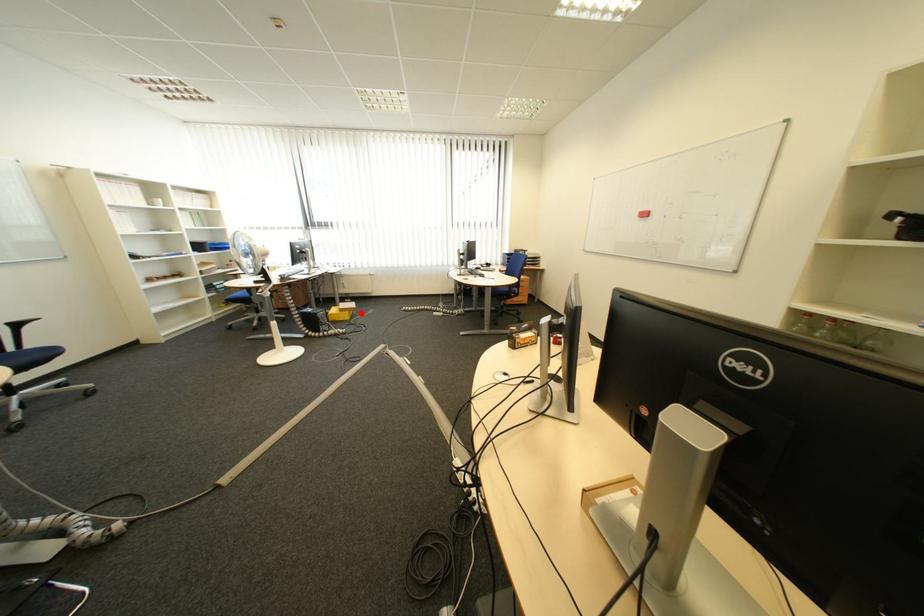
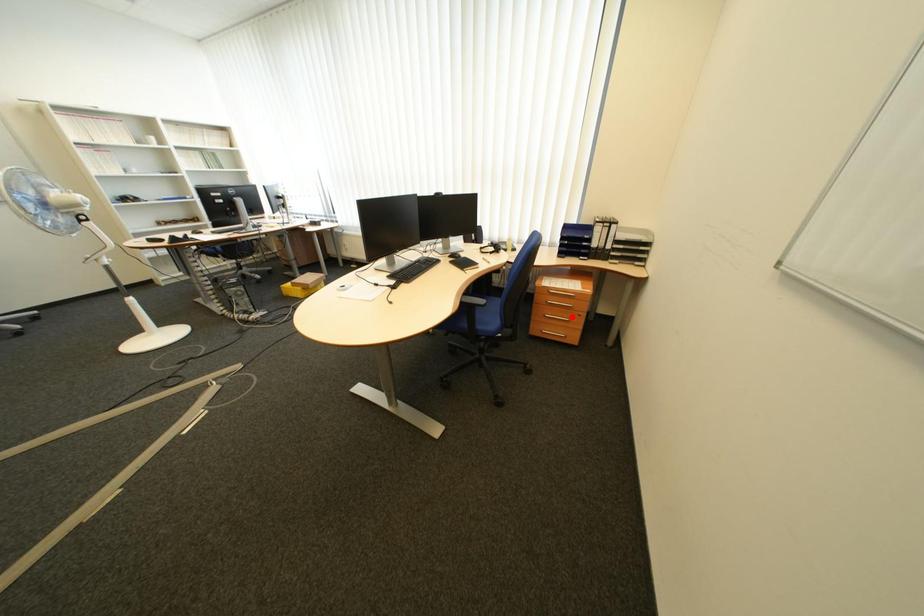
I am providing you with two images of the same scene from different viewpoints. A red point is marked on the first image and another point is marked on the second image. Do the highlighted points in image1 and image2 indicate the same real-world spot?

No